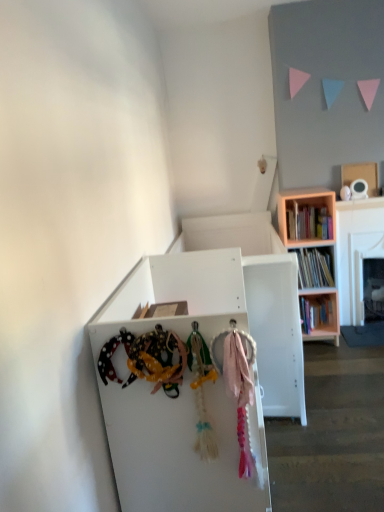
Question: Can you confirm if cardboard box at upper right is smaller than pink fabric at center?

Choices:
 (A) no
 (B) yes

Answer: (B)

Question: Is cardboard box at upper right bigger than pink fabric at center?

Choices:
 (A) yes
 (B) no

Answer: (B)

Question: Does cardboard box at upper right appear on the right side of pink fabric at center?

Choices:
 (A) no
 (B) yes

Answer: (B)

Question: From the image's perspective, would you say cardboard box at upper right is shown under pink fabric at center?

Choices:
 (A) yes
 (B) no

Answer: (B)

Question: Is cardboard box at upper right looking in the opposite direction of pink fabric at center?

Choices:
 (A) no
 (B) yes

Answer: (A)

Question: From a real-world perspective, is cardboard box at upper right above or below pink fabric at center?

Choices:
 (A) above
 (B) below

Answer: (A)

Question: Looking at the image, does cardboard box at upper right seem bigger or smaller compared to pink fabric at center?

Choices:
 (A) small
 (B) big

Answer: (A)

Question: In the image, is cardboard box at upper right positioned in front of or behind pink fabric at center?

Choices:
 (A) front
 (B) behind

Answer: (B)

Question: In the image, is cardboard box at upper right on the left side or the right side of pink fabric at center?

Choices:
 (A) right
 (B) left

Answer: (A)

Question: Looking at their shapes, would you say wooden bookshelf at right is wider or thinner than cardboard box at upper right?

Choices:
 (A) thin
 (B) wide

Answer: (B)

Question: From their relative heights in the image, would you say wooden bookshelf at right is taller or shorter than cardboard box at upper right?

Choices:
 (A) short
 (B) tall

Answer: (B)

Question: From a real-world perspective, is wooden bookshelf at right physically located above or below cardboard box at upper right?

Choices:
 (A) above
 (B) below

Answer: (B)

Question: Considering their positions, is wooden bookshelf at right located in front of or behind cardboard box at upper right?

Choices:
 (A) front
 (B) behind

Answer: (A)

Question: In terms of size, does wooden bookcase at upper right appear bigger or smaller than white matte cabinet at center?

Choices:
 (A) big
 (B) small

Answer: (B)

Question: Considering the positions of wooden bookcase at upper right and white matte cabinet at center in the image, is wooden bookcase at upper right taller or shorter than white matte cabinet at center?

Choices:
 (A) short
 (B) tall

Answer: (B)